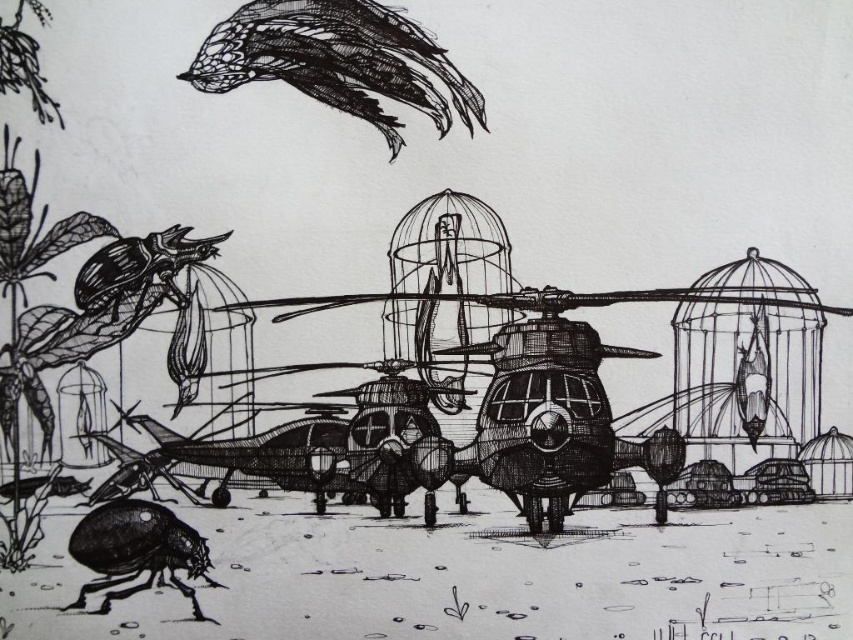
You are an entomologist examining the surreal scene. You notice two beetles, the shiny black beetle at lower left and the matte black beetle at upper left. Which beetle is located lower in the image?

The shiny black beetle at lower left is positioned under the matte black beetle at upper left, so the shiny black beetle at lower left is located lower in the image.

Based on the photo, you are an entomologist observing the scene. You need to determine which beetle is smaller in width between the shiny black beetle at lower left and the matte black beetle at upper left. Which one is it?

The shiny black beetle at lower left has a lesser width compared to the matte black beetle at upper left, so the shiny black beetle at lower left is smaller in width.